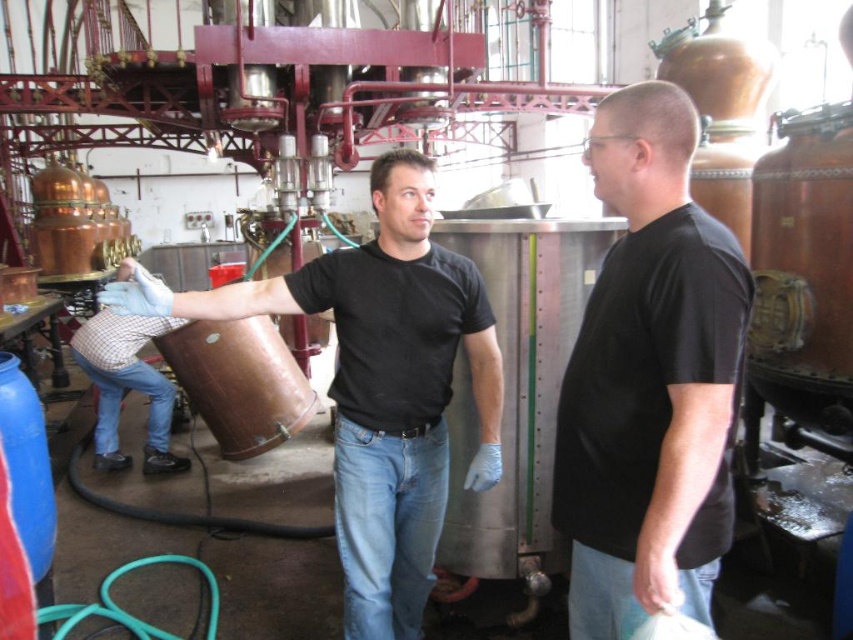
Question: Which of the following is the closest to the observer?

Choices:
 (A) matte black shirt at center
 (B) black matte shirt at center

Answer: (B)

Question: Which point is closer to the camera taking this photo?

Choices:
 (A) (109, 445)
 (B) (606, 634)
 (C) (372, 544)

Answer: (B)

Question: Does black matte shirt at center appear over checkered shirt at lower left?

Choices:
 (A) yes
 (B) no

Answer: (A)

Question: Does black matte shirt at center appear on the left side of checkered shirt at lower left?

Choices:
 (A) yes
 (B) no

Answer: (B)

Question: Can you confirm if matte black shirt at center is smaller than checkered shirt at lower left?

Choices:
 (A) no
 (B) yes

Answer: (B)

Question: Which point is closer to the camera taking this photo?

Choices:
 (A) (598, 396)
 (B) (99, 317)
 (C) (315, 300)

Answer: (A)